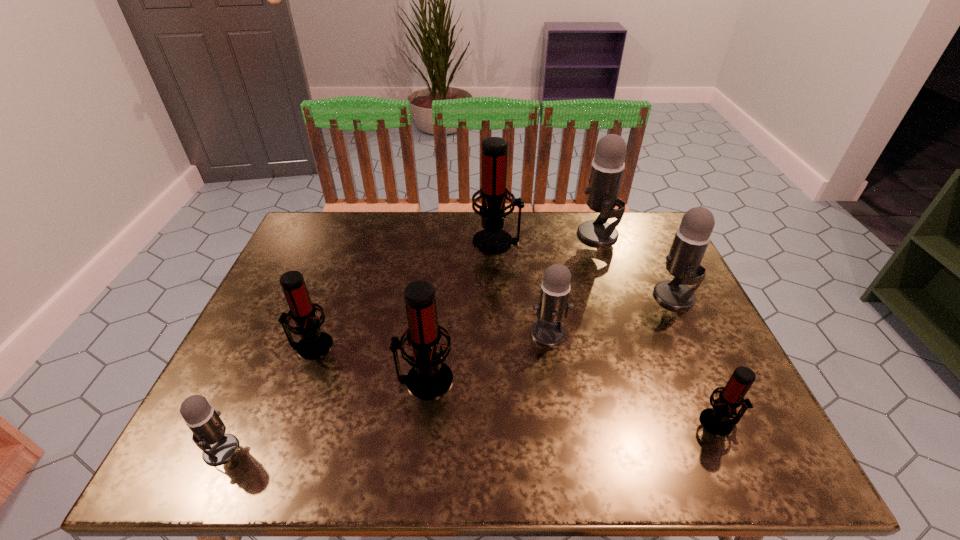
Image resolution: width=960 pixels, height=540 pixels. Find the location of `free spot located 0.230m on the back of the third nearest red microphone`. free spot located 0.230m on the back of the third nearest red microphone is located at coordinates (339, 272).

Image resolution: width=960 pixels, height=540 pixels. What are the coordinates of `vacant space situated on the left of the second nearest gray microphone` in the screenshot? It's located at (496, 333).

At what (x,y) coordinates should I click in order to perform the action: click on free point located 0.090m on the left of the rightmost red microphone. Please return your answer as a coordinate pair (x, y). The width and height of the screenshot is (960, 540). Looking at the image, I should click on (656, 422).

Locate an element on the screen. The width and height of the screenshot is (960, 540). object that is positioned at the near left corner is located at coordinates (208, 429).

The image size is (960, 540). In order to click on object at the far right corner in this screenshot , I will do `click(608, 165)`.

The height and width of the screenshot is (540, 960). What are the coordinates of `object at the near right corner` in the screenshot? It's located at (719, 420).

Image resolution: width=960 pixels, height=540 pixels. In the image, there is a desktop. In order to click on vacant space at the far edge in this screenshot , I will do `click(470, 213)`.

In the image, there is a desktop. Identify the location of free space at the near edge. This screenshot has width=960, height=540. (672, 450).

Where is `vacant space at the left edge of the desktop`? This screenshot has width=960, height=540. vacant space at the left edge of the desktop is located at coordinates (287, 386).

You are a GUI agent. You are given a task and a screenshot of the screen. Output one action in this format:
    pyautogui.click(x=<x>, y=<y>)
    Task: Click on the vacant space at the right edge
    Image resolution: width=960 pixels, height=540 pixels.
    Given the screenshot: What is the action you would take?
    pyautogui.click(x=713, y=384)